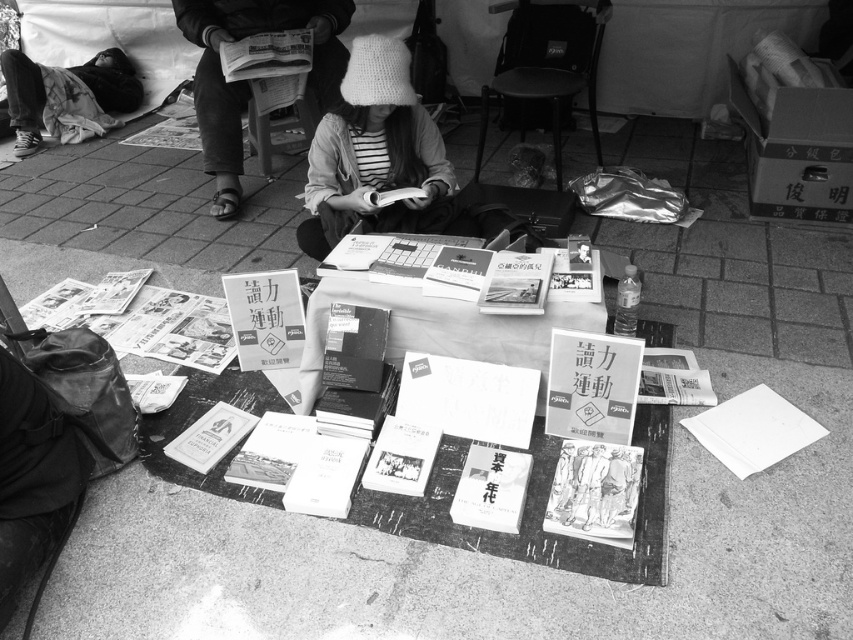
You are standing in the scene and want to place a small notebook exactly where the white knitted hat at center is located. What coordinates should you use?

The white knitted hat at center is located at coordinates point (374, 152), so you should place the notebook at those coordinates.

You are standing in the outdoor scene described. There is a point at coordinates (374, 152). What object is located at that point?

The point at coordinates (374, 152) corresponds to the white knitted hat at center.